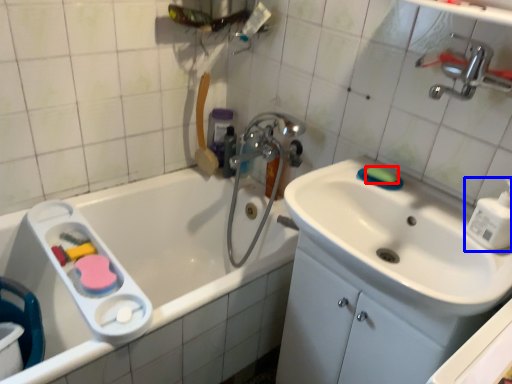
Question: Which object appears closest to the camera in this image, soap (highlighted by a red box) or soap dispenser (highlighted by a blue box)?

Choices:
 (A) soap
 (B) soap dispenser

Answer: (B)